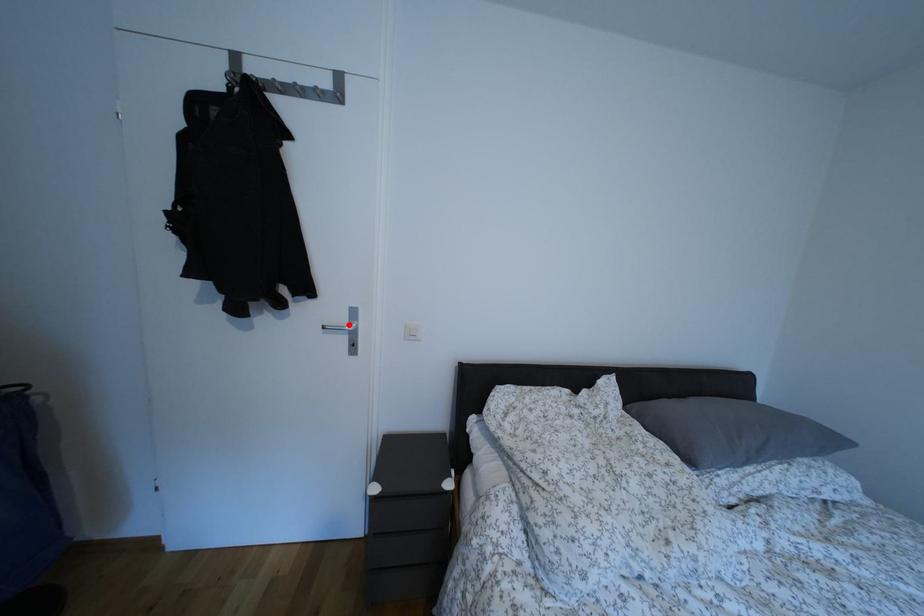
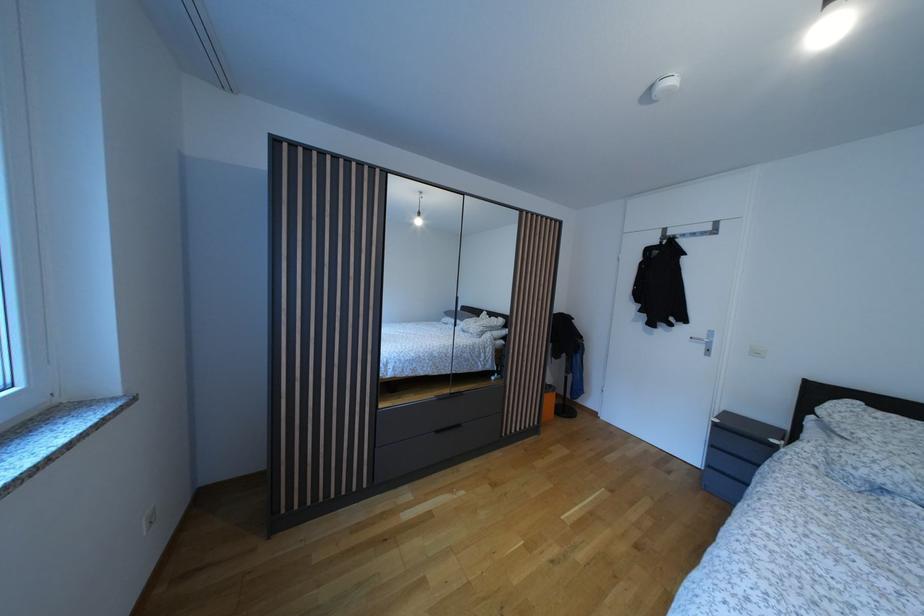
The point at the highlighted location is marked in the first image. Where is the corresponding point in the second image?

(709, 342)